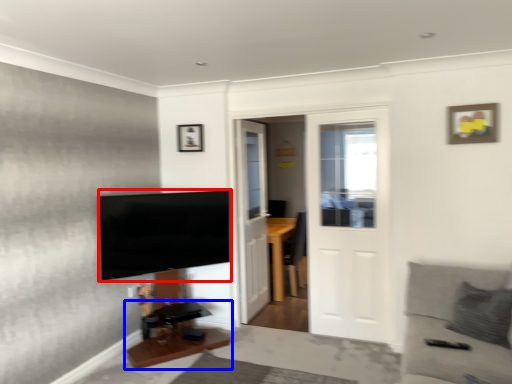
Question: Among these objects, which one is nearest to the camera, television (highlighted by a red box) or table (highlighted by a blue box)?

Choices:
 (A) television
 (B) table

Answer: (B)